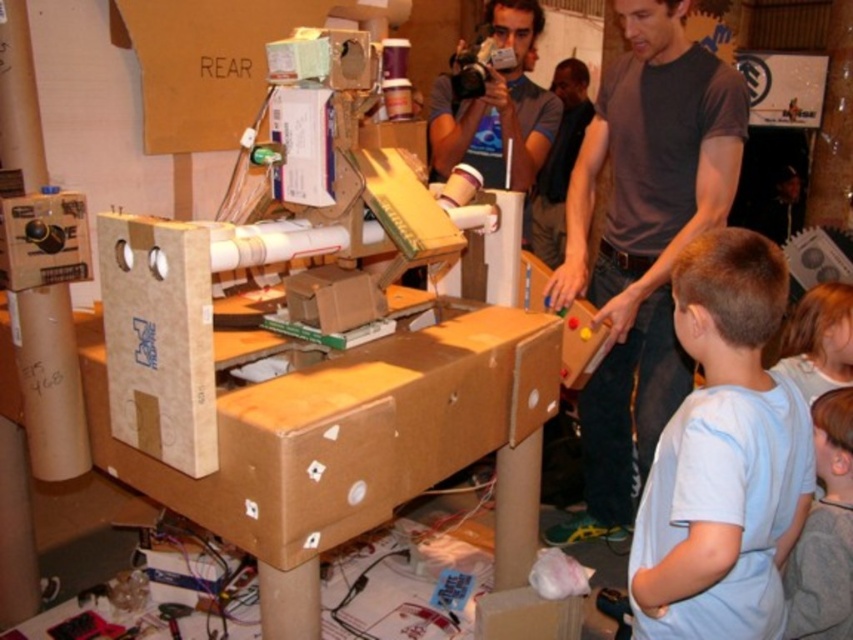
Can you confirm if matte blue shirt at upper center is bigger than light blue shirt at lower right?

Yes, matte blue shirt at upper center is bigger than light blue shirt at lower right.

Does point (525, 8) come in front of point (820, 380)?

That is False.

Is point (544, 134) positioned before point (839, 371)?

That is False.

Locate an element on the screen. The image size is (853, 640). matte blue shirt at upper center is located at coordinates (498, 108).

Who is higher up, light blue cotton shirt at lower right or light brown hair at upper right?

light blue cotton shirt at lower right

Does light blue cotton shirt at lower right appear on the right side of light brown hair at upper right?

Incorrect, light blue cotton shirt at lower right is not on the right side of light brown hair at upper right.

Does point (727, 458) come farther from viewer compared to point (844, 548)?

No, (727, 458) is in front of (844, 548).

You are a GUI agent. You are given a task and a screenshot of the screen. Output one action in this format:
    pyautogui.click(x=<x>, y=<y>)
    Task: Click on the light blue cotton shirt at lower right
    This screenshot has height=640, width=853.
    Given the screenshot: What is the action you would take?
    pyautogui.click(x=723, y=458)

Can you confirm if light blue cotton shirt at lower right is shorter than light blue shirt at lower right?

No, light blue cotton shirt at lower right is not shorter than light blue shirt at lower right.

Between point (734, 486) and point (796, 321), which one is positioned behind?

Point (796, 321)

Locate an element on the screen. Image resolution: width=853 pixels, height=640 pixels. light blue cotton shirt at lower right is located at coordinates (x=723, y=458).